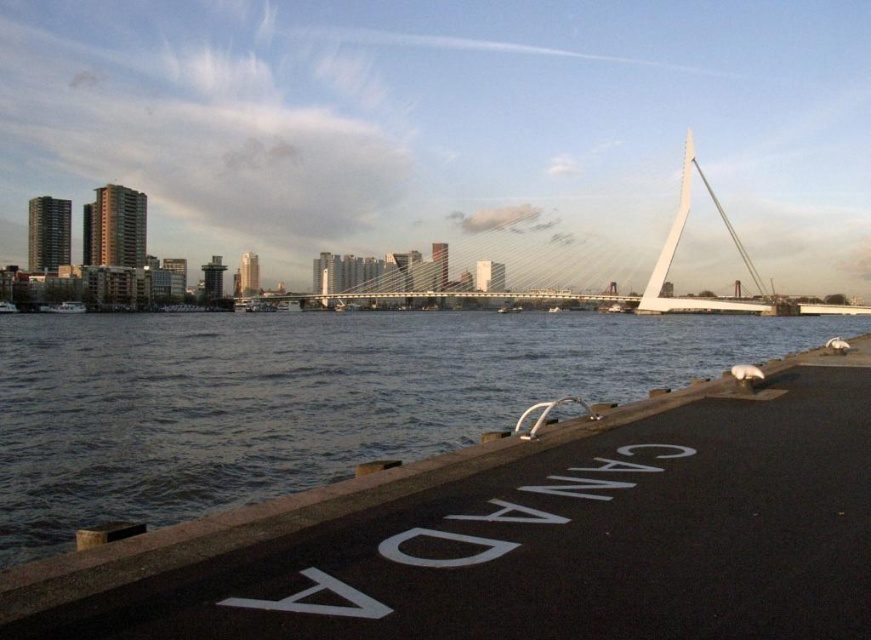
Question: Which point is closer to the camera?

Choices:
 (A) (714, 554)
 (B) (730, 234)
 (C) (59, 307)

Answer: (A)

Question: Based on their relative distances, which object is farther from the black asphalt dock at lower right?

Choices:
 (A) white matte boat at left
 (B) white cable-stayed bridge at center

Answer: (B)

Question: Does black asphalt dock at lower right lie behind white matte boat at left?

Choices:
 (A) yes
 (B) no

Answer: (B)

Question: Estimate the real-world distances between objects in this image. Which object is farther from the white cable-stayed bridge at center?

Choices:
 (A) black asphalt dock at lower right
 (B) white matte boat at left

Answer: (A)

Question: Can you confirm if black asphalt dock at lower right is wider than white matte boat at left?

Choices:
 (A) no
 (B) yes

Answer: (A)

Question: Does black asphalt dock at lower right appear under white matte boat at left?

Choices:
 (A) no
 (B) yes

Answer: (B)